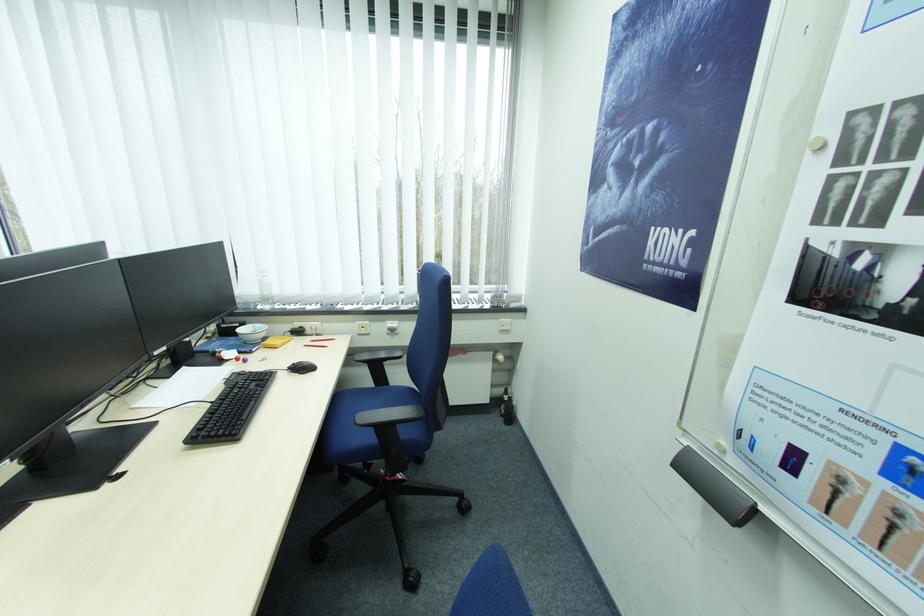
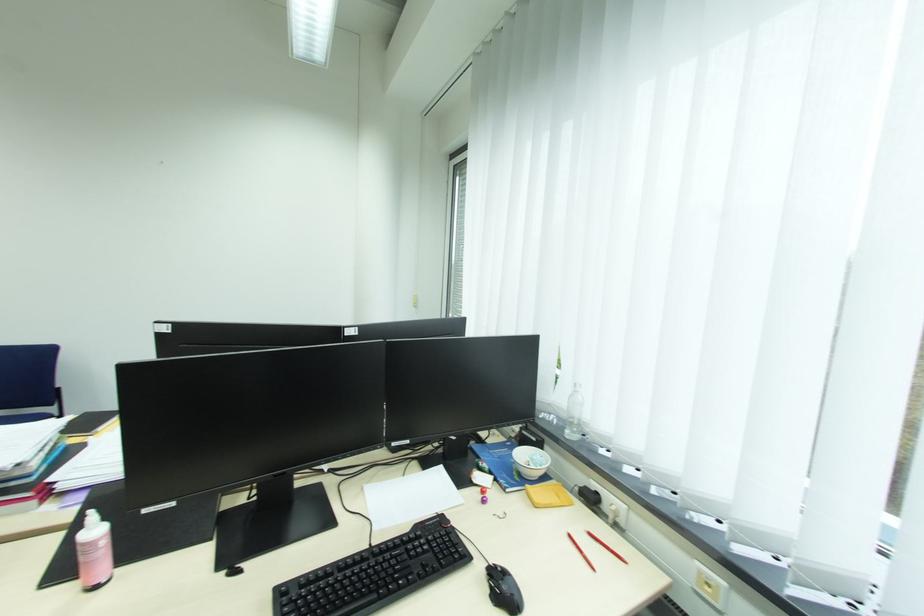
Question: The camera is either moving clockwise (left) or counter-clockwise (right) around the object. The first image is from the beginning of the video and the second image is from the end. Is the camera moving left or right when shooting the video?

Choices:
 (A) Left
 (B) Right

Answer: (B)